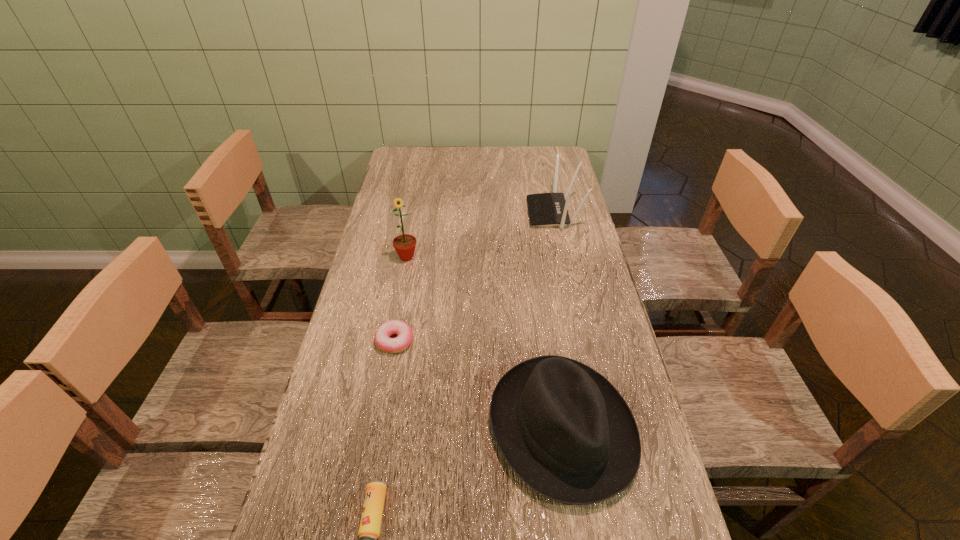
I want to click on vacant area located 0.140m on the front of the doughnut, so coord(383,404).

Identify the location of sunflower that is at the left edge. (404, 244).

Where is `doughnut that is at the left edge`? This screenshot has width=960, height=540. doughnut that is at the left edge is located at coordinates (382, 335).

Where is `router positioned at the right edge`? router positioned at the right edge is located at coordinates (545, 209).

The image size is (960, 540). Find the location of `fedora at the right edge`. fedora at the right edge is located at coordinates (564, 429).

Where is `vacant space at the far edge of the desktop`? This screenshot has width=960, height=540. vacant space at the far edge of the desktop is located at coordinates (474, 157).

Locate an element on the screen. vacant space at the left edge of the desktop is located at coordinates (376, 447).

Locate an element on the screen. vacant space at the right edge of the desktop is located at coordinates (572, 322).

In the image, there is a desktop. Where is `free region at the far left corner`? This screenshot has width=960, height=540. free region at the far left corner is located at coordinates point(404,151).

The width and height of the screenshot is (960, 540). In order to click on free spot between the third farthest object and the second farthest object in this screenshot , I will do `click(400, 299)`.